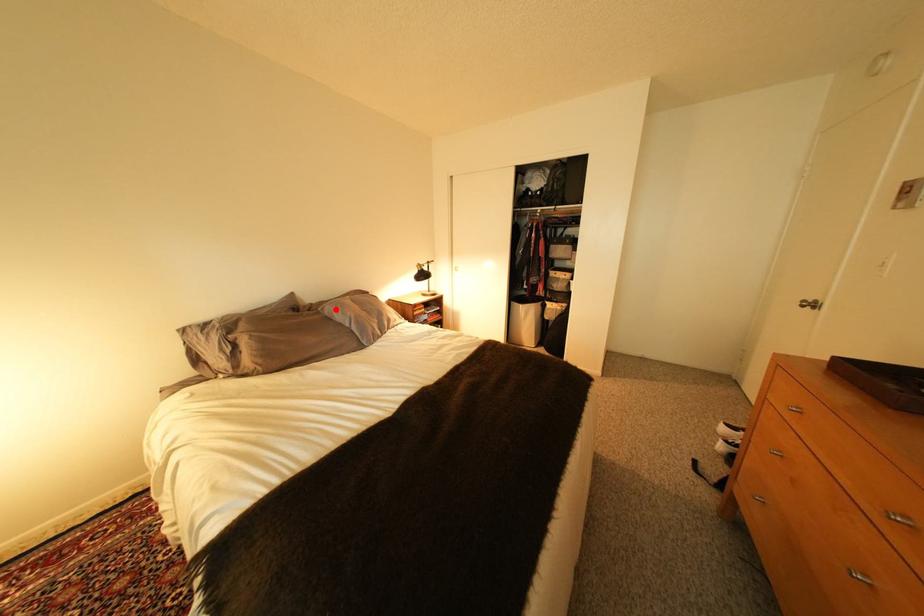
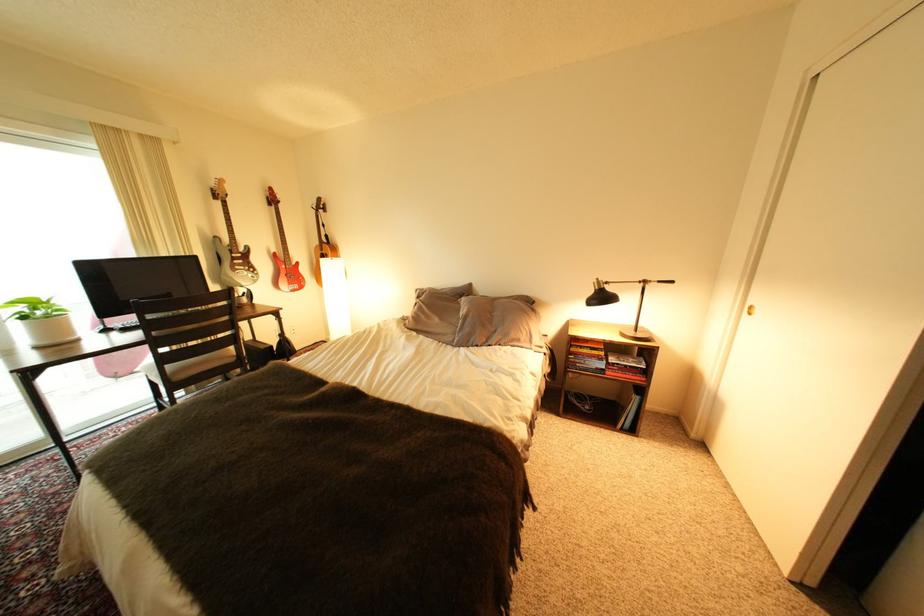
Where in the second image is the point corresponding to the highlighted location from the first image?

(473, 302)